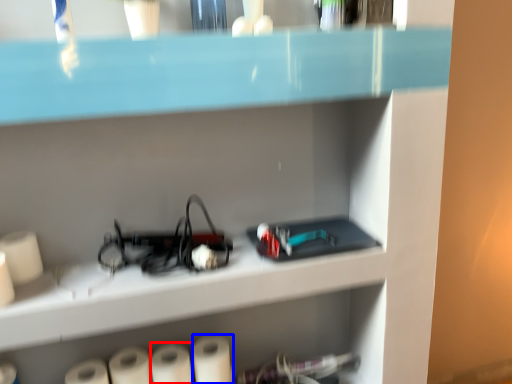
Question: Which object appears closest to the camera in this image, paper towel (highlighted by a red box) or paper towel (highlighted by a blue box)?

Choices:
 (A) paper towel
 (B) paper towel

Answer: (A)